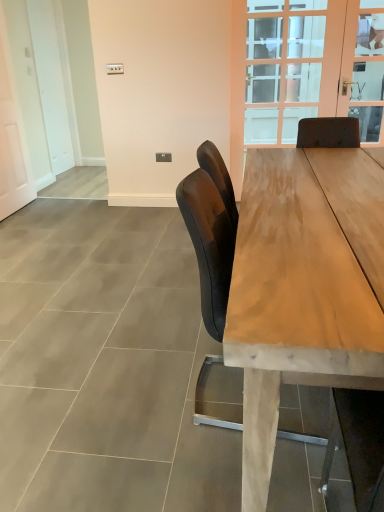
Question: Considering the relative positions of clear glass door at upper right and matte black chair at center in the image provided, is clear glass door at upper right to the left of matte black chair at center from the viewer's perspective?

Choices:
 (A) yes
 (B) no

Answer: (B)

Question: Considering the relative sizes of clear glass door at upper right and matte black chair at center in the image provided, is clear glass door at upper right shorter than matte black chair at center?

Choices:
 (A) no
 (B) yes

Answer: (A)

Question: Does clear glass door at upper right lie behind matte black chair at center?

Choices:
 (A) yes
 (B) no

Answer: (A)

Question: Would you say clear glass door at upper right is outside matte black chair at center?

Choices:
 (A) yes
 (B) no

Answer: (A)

Question: Is clear glass door at upper right turned away from matte black chair at center?

Choices:
 (A) yes
 (B) no

Answer: (B)

Question: Considering the relative positions of clear glass door at upper right and matte black chair at center in the image provided, is clear glass door at upper right to the right of matte black chair at center from the viewer's perspective?

Choices:
 (A) yes
 (B) no

Answer: (A)

Question: Does wooden table at center lie in front of clear glass door at upper center?

Choices:
 (A) yes
 (B) no

Answer: (A)

Question: From a real-world perspective, does wooden table at center sit lower than clear glass door at upper center?

Choices:
 (A) yes
 (B) no

Answer: (A)

Question: Is wooden table at center smaller than clear glass door at upper center?

Choices:
 (A) yes
 (B) no

Answer: (B)

Question: Does wooden table at center have a lesser width compared to clear glass door at upper center?

Choices:
 (A) yes
 (B) no

Answer: (B)

Question: Is wooden table at center completely or partially outside of clear glass door at upper center?

Choices:
 (A) yes
 (B) no

Answer: (A)

Question: Is there a large distance between wooden table at center and clear glass door at upper center?

Choices:
 (A) no
 (B) yes

Answer: (B)

Question: Is matte black chair at center facing towards wooden table at center?

Choices:
 (A) yes
 (B) no

Answer: (A)